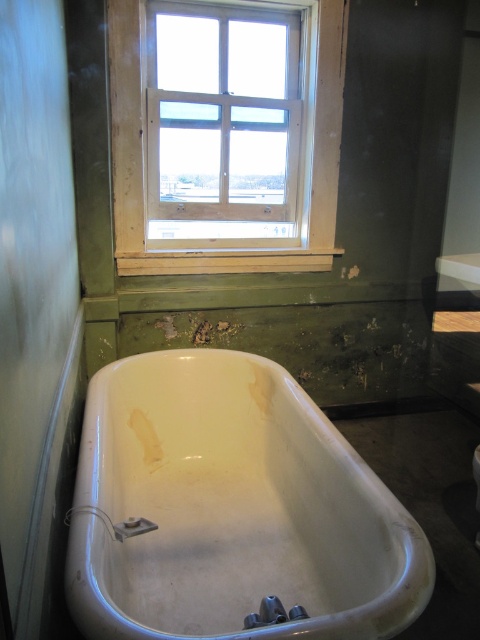
You are standing in the bathroom and want to reach a specific point marked at coordinates point (98, 404). If your arm can extend 1.8 meters, can you reach that point without moving closer?

The point (98, 404) is 1.91 meters away from the viewer, which is slightly beyond the arm extension of 1.8 meters. Therefore, you cannot reach it without moving closer.

You are standing in the bathroom and want to take a photo of the white glossy bathtub at lower center. If your camera requires a minimum distance of 36 inches to focus properly, will you be able to take a clear photo from your current position?

The white glossy bathtub at lower center and camera are 36.87 inches apart from each other. Since 36.87 inches is greater than the minimum required 36 inches, you can take a clear photo from your current position.